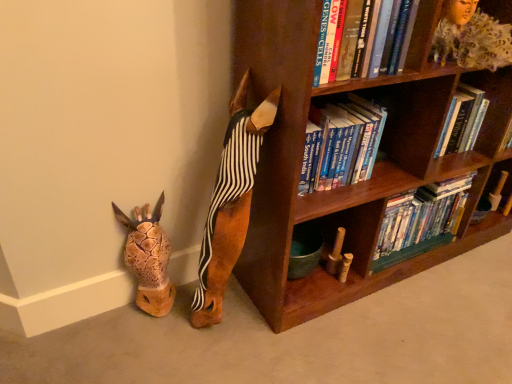
Where is `free space in front of wooden giraffe head at lower left, which ranks as the 2th animal in right-to-left order`? This screenshot has width=512, height=384. free space in front of wooden giraffe head at lower left, which ranks as the 2th animal in right-to-left order is located at coordinates (140, 341).